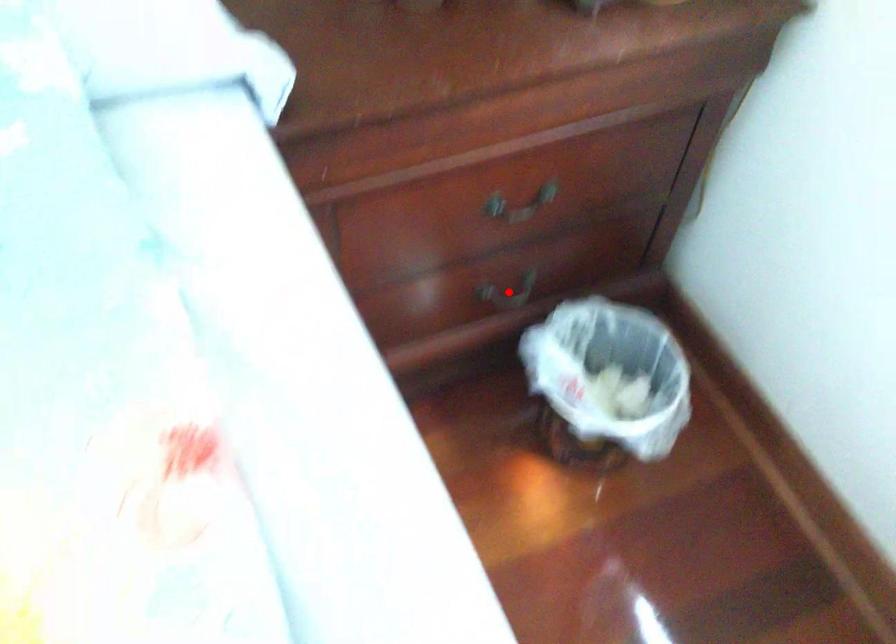
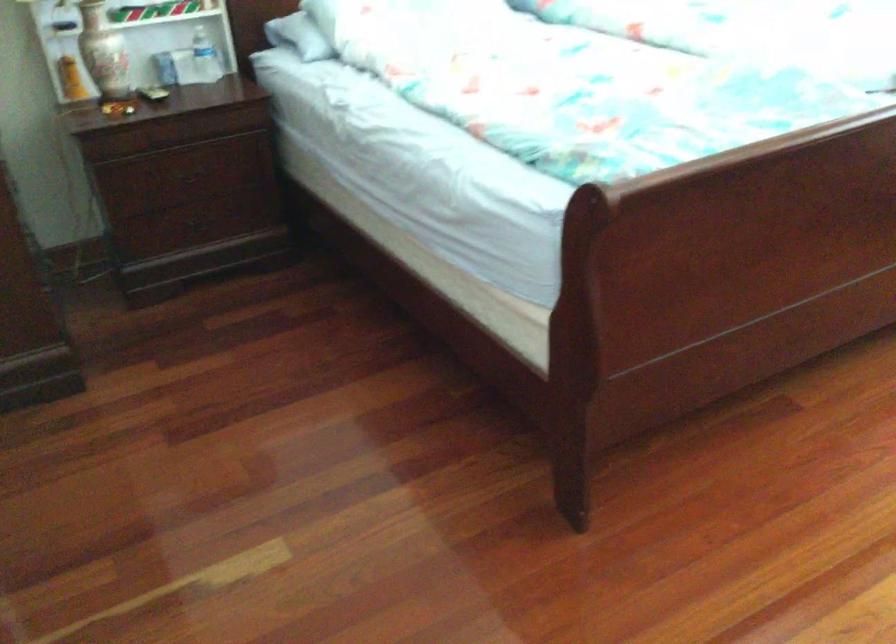
Question: I am providing you with two images of the same scene from different viewpoints. A red point is marked on the first image. Is the red point's position out of view in image 2?

Choices:
 (A) Yes
 (B) No

Answer: (A)